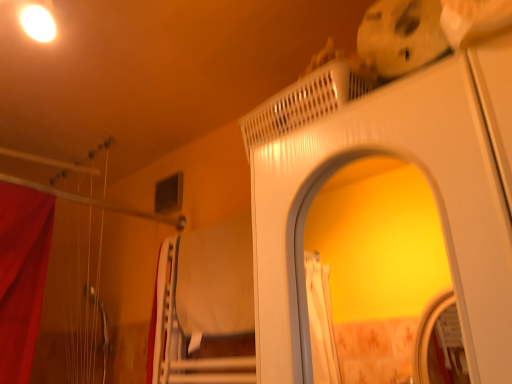
Find the location of `white textured bed at center`. white textured bed at center is located at coordinates (204, 308).

At what (x,y) coordinates should I click in order to perform the action: click on white glossy screen door at upper center. Please return your answer as a coordinate pair (x, y). This screenshot has width=512, height=384. Looking at the image, I should click on [x=394, y=157].

How different are the orientations of white textured bed at center and white fabric curtain at lower left in degrees?

0.00443 degrees.

Which is in front, white textured bed at center or white fabric curtain at lower left?

white textured bed at center is in front.

Which object is positioned more to the right, white textured bed at center or white fabric curtain at lower left?

white textured bed at center is more to the right.

Measure the distance between white textured bed at center and white fabric curtain at lower left.

white textured bed at center and white fabric curtain at lower left are 14.20 centimeters apart from each other.

Is white fabric curtain at lower left facing away from white glossy screen door at upper center?

No, white fabric curtain at lower left is not facing the opposite direction of white glossy screen door at upper center.

Is white fabric curtain at lower left next to white glossy screen door at upper center and touching it?

Result: No, white fabric curtain at lower left is not making contact with white glossy screen door at upper center.

Considering the positions of objects white fabric curtain at lower left and white glossy screen door at upper center in the image provided, who is more to the right, white fabric curtain at lower left or white glossy screen door at upper center?

white glossy screen door at upper center is more to the right.

Who is smaller, white fabric curtain at lower left or white glossy screen door at upper center?

Smaller between the two is white fabric curtain at lower left.

Who is bigger, white glossy screen door at upper center or white fabric curtain at lower left?

Bigger between the two is white glossy screen door at upper center.

Which is in front, white glossy screen door at upper center or white fabric curtain at lower left?

white glossy screen door at upper center.

Which is in front, point (291, 286) or point (160, 253)?

The point (291, 286) is closer.

Considering the relative sizes of white glossy screen door at upper center and white fabric curtain at lower left in the image provided, is white glossy screen door at upper center wider than white fabric curtain at lower left?

Correct, the width of white glossy screen door at upper center exceeds that of white fabric curtain at lower left.

Consider the image. Is white glossy screen door at upper center at the left side of white textured bed at center?

No.

From a real-world perspective, is white glossy screen door at upper center located higher than white textured bed at center?

No.

Between white glossy screen door at upper center and white textured bed at center, which one is positioned behind?

white textured bed at center is further away from the camera.

Could you tell me if white glossy screen door at upper center is turned towards white textured bed at center?

No, white glossy screen door at upper center is not aimed at white textured bed at center.

From a real-world perspective, between white fabric curtain at lower left and white textured bed at center, who is vertically lower?

In real-world perspective, white fabric curtain at lower left is lower.

Considering the sizes of objects white fabric curtain at lower left and white textured bed at center in the image provided, who is taller, white fabric curtain at lower left or white textured bed at center?

With more height is white fabric curtain at lower left.

I want to click on curtain that is behind the white textured bed at center, so click(x=152, y=327).

From the picture: Relative to white textured bed at center, is white fabric curtain at lower left in front or behind?

In the image, white fabric curtain at lower left appears behind white textured bed at center.

Is point (213, 324) less distant than point (329, 80)?

No, it is not.

From the image's perspective, is white textured bed at center beneath white glossy screen door at upper center?

Yes.

In terms of size, does white textured bed at center appear bigger or smaller than white glossy screen door at upper center?

Clearly, white textured bed at center is smaller in size than white glossy screen door at upper center.

Find the location of a particular element. curtain beneath the white textured bed at center (from a real-world perspective) is located at coordinates (152, 327).

Where is `curtain above the white glossy screen door at upper center (from a real-world perspective)`? curtain above the white glossy screen door at upper center (from a real-world perspective) is located at coordinates (152, 327).

When comparing their distances from white textured bed at center, does white glossy screen door at upper center or white fabric curtain at lower left seem further?

white glossy screen door at upper center is positioned further to the anchor white textured bed at center.

Which object lies further to the anchor point white glossy screen door at upper center, white fabric curtain at lower left or white textured bed at center?

white fabric curtain at lower left is further to white glossy screen door at upper center.

Considering their positions, is white fabric curtain at lower left positioned closer to white textured bed at center than white glossy screen door at upper center?

white fabric curtain at lower left is positioned closer to the anchor white textured bed at center.

From the image, which object appears to be farther from white fabric curtain at lower left, white glossy screen door at upper center or white textured bed at center?

white glossy screen door at upper center.

When comparing their distances from white fabric curtain at lower left, does white textured bed at center or white glossy screen door at upper center seem further?

white glossy screen door at upper center.

Looking at the image, which one is located further to white glossy screen door at upper center, white textured bed at center or white fabric curtain at lower left?

Among the two, white fabric curtain at lower left is located further to white glossy screen door at upper center.

Where is `bed between white glossy screen door at upper center and white fabric curtain at lower left from front to back`? This screenshot has width=512, height=384. bed between white glossy screen door at upper center and white fabric curtain at lower left from front to back is located at coordinates (204, 308).